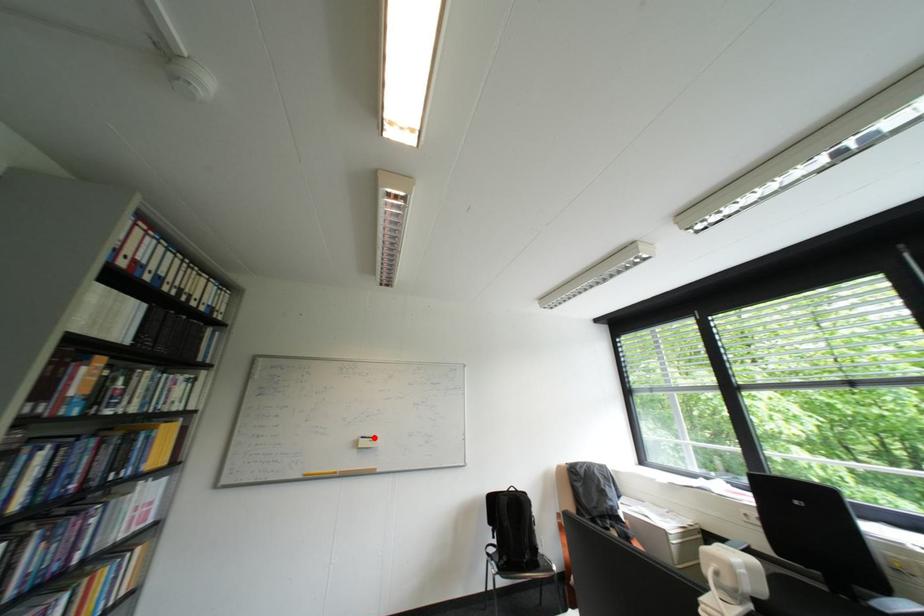
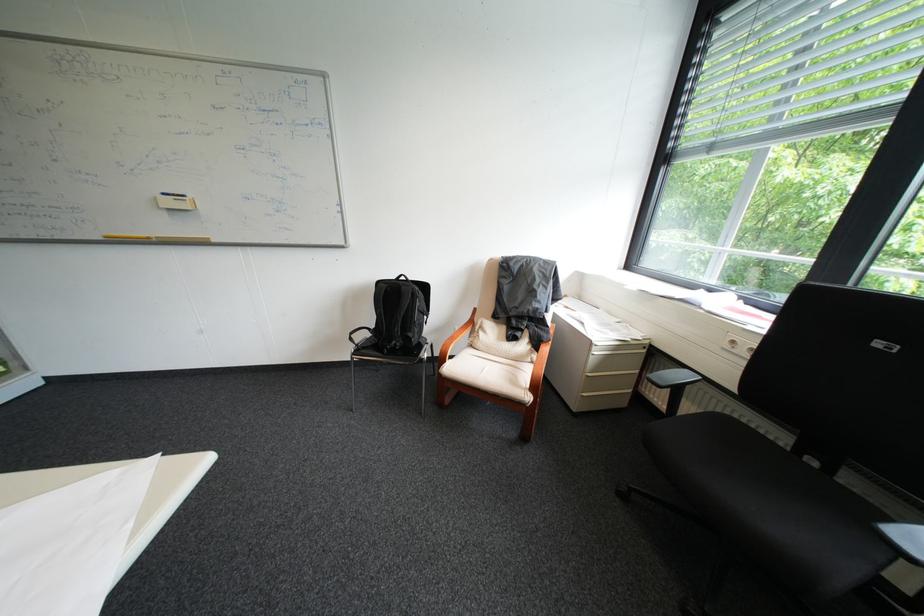
Locate, in the second image, the point that corresponds to the highlighted location in the first image.

(176, 195)